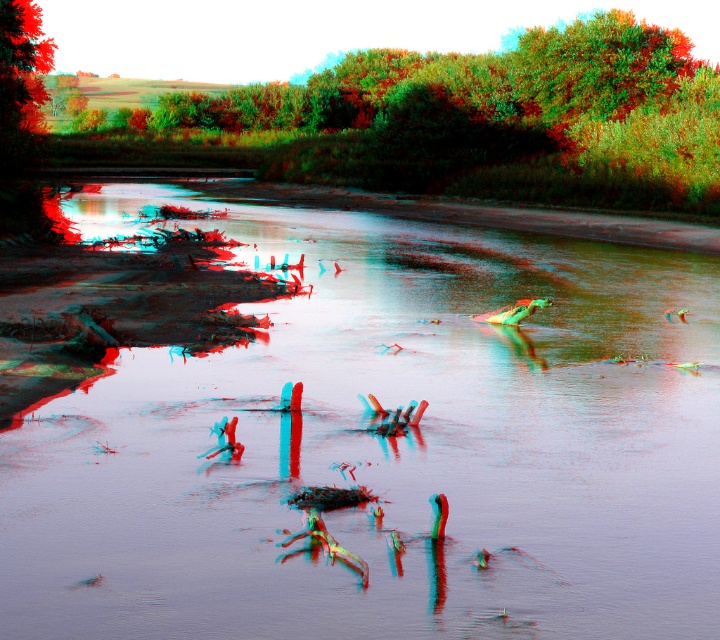
Question: Which is nearer to the translucent plastic river at center?

Choices:
 (A) green leafy tree at upper left
 (B) green leafy tree at upper center

Answer: (A)

Question: Can you confirm if translucent plastic river at center is positioned above green leafy tree at upper center?

Choices:
 (A) yes
 (B) no

Answer: (B)

Question: Among these points, which one is farthest from the camera?

Choices:
 (A) (307, 580)
 (B) (562, 186)

Answer: (B)

Question: Does translucent plastic river at center appear on the right side of green leafy tree at upper center?

Choices:
 (A) no
 (B) yes

Answer: (A)

Question: Which object is farther from the camera taking this photo?

Choices:
 (A) green leafy tree at upper center
 (B) green leafy tree at upper left
 (C) translucent plastic river at center

Answer: (B)

Question: Is translucent plastic river at center further to the viewer compared to green leafy tree at upper left?

Choices:
 (A) no
 (B) yes

Answer: (A)